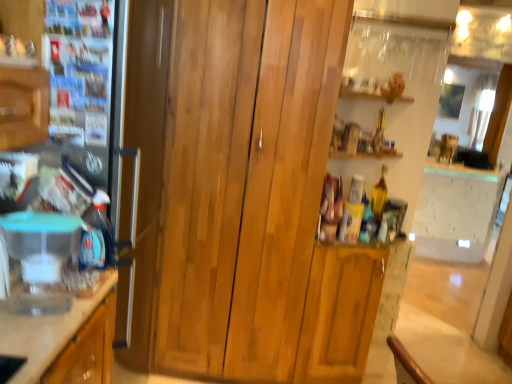
Question: Does satin silver fridge at left have a greater height compared to clear plastic container at left?

Choices:
 (A) yes
 (B) no

Answer: (A)

Question: From a real-world perspective, does satin silver fridge at left stand above clear plastic container at left?

Choices:
 (A) no
 (B) yes

Answer: (B)

Question: Is satin silver fridge at left far away from clear plastic container at left?

Choices:
 (A) yes
 (B) no

Answer: (B)

Question: Is satin silver fridge at left outside clear plastic container at left?

Choices:
 (A) yes
 (B) no

Answer: (A)

Question: Is the depth of satin silver fridge at left less than that of clear plastic container at left?

Choices:
 (A) yes
 (B) no

Answer: (B)

Question: Is transparent plastic container at left wider or thinner than clear plastic container at left?

Choices:
 (A) wide
 (B) thin

Answer: (B)

Question: Relative to clear plastic container at left, is transparent plastic container at left in front or behind?

Choices:
 (A) front
 (B) behind

Answer: (B)

Question: Is point [71, 296] closer or farther from the camera than point [31, 332]?

Choices:
 (A) closer
 (B) farther

Answer: (B)

Question: From the image's perspective, is transparent plastic container at left above or below clear plastic container at left?

Choices:
 (A) above
 (B) below

Answer: (A)

Question: From their relative heights in the image, would you say wooden cabinet at center is taller or shorter than clear plastic container at left?

Choices:
 (A) short
 (B) tall

Answer: (B)

Question: In the image, is wooden cabinet at center on the left side or the right side of clear plastic container at left?

Choices:
 (A) left
 (B) right

Answer: (B)

Question: Considering the positions of point (257, 286) and point (47, 327), is point (257, 286) closer or farther from the camera than point (47, 327)?

Choices:
 (A) closer
 (B) farther

Answer: (B)

Question: In the image, is wooden cabinet at center positioned in front of or behind clear plastic container at left?

Choices:
 (A) behind
 (B) front

Answer: (A)

Question: From a real-world perspective, is clear plastic container at left physically located above or below transparent plastic container at left?

Choices:
 (A) above
 (B) below

Answer: (B)

Question: Is point (53, 357) closer or farther from the camera than point (37, 284)?

Choices:
 (A) farther
 (B) closer

Answer: (B)